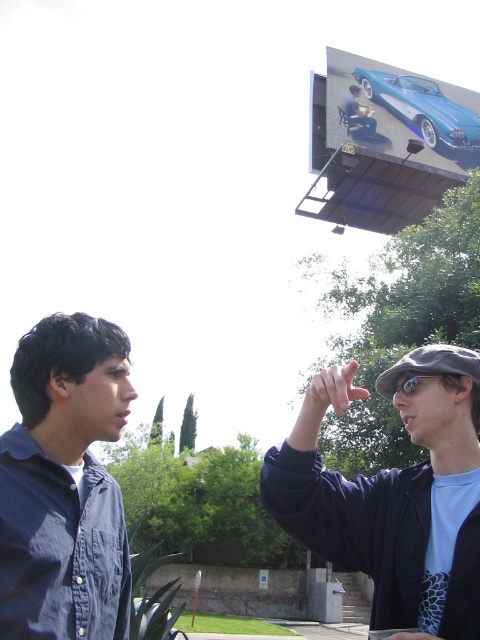
Can you confirm if matte black car at upper center is positioned to the right of clear plastic goggles at upper center?

Indeed, matte black car at upper center is positioned on the right side of clear plastic goggles at upper center.

Does matte black car at upper center have a larger size compared to clear plastic goggles at upper center?

Correct, matte black car at upper center is larger in size than clear plastic goggles at upper center.

Identify the location of matte black car at upper center. (356, 113).

Is denim shirt at left positioned at the back of clear plastic goggles at upper center?

That is False.

Who is more forward, (36, 333) or (411, 385)?

Positioned in front is point (36, 333).

The image size is (480, 640). What are the coordinates of `denim shirt at left` in the screenshot? It's located at (64, 484).

Is shiny blue car at upper right above matte black car at upper center?

Yes, shiny blue car at upper right is above matte black car at upper center.

Which is behind, point (349, 74) or point (354, 113)?

The point (349, 74) is more distant.

Is point (453, 156) positioned before point (348, 131)?

No.

Locate an element on the screen. The height and width of the screenshot is (640, 480). shiny blue car at upper right is located at coordinates (399, 112).